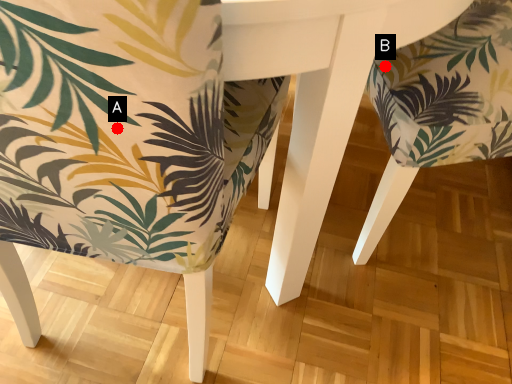
Question: Two points are circled on the image, labeled by A and B beside each circle. Which point is farther from the camera taking this photo?

Choices:
 (A) A is further
 (B) B is further

Answer: (B)